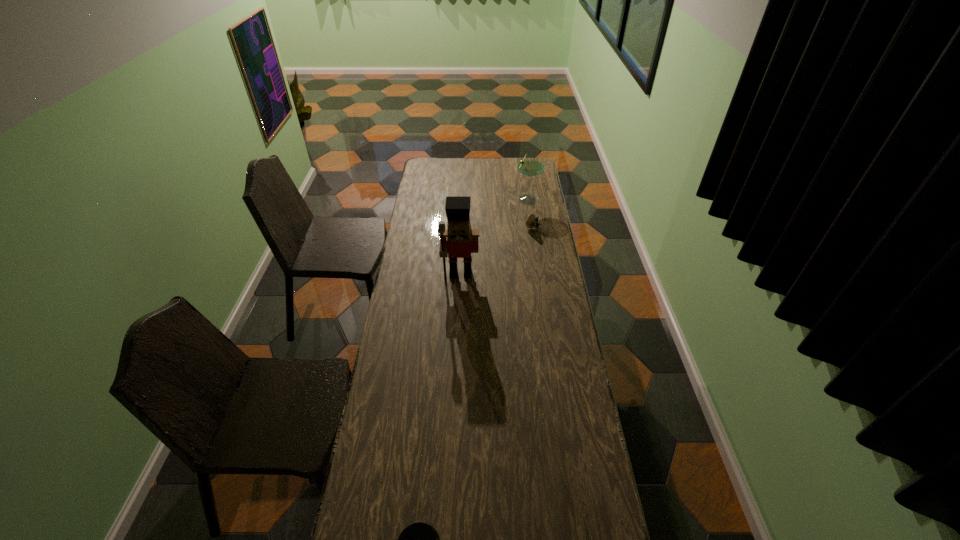
The height and width of the screenshot is (540, 960). In order to click on the tallest object in this screenshot , I will do `click(459, 240)`.

Image resolution: width=960 pixels, height=540 pixels. I want to click on nutcracker, so click(459, 240).

In order to click on martini in this screenshot , I will do 530,166.

Locate an element on the screen. the farthest object is located at coordinates (530, 166).

The image size is (960, 540). Find the location of `avocado`. avocado is located at coordinates (532, 222).

Locate an element on the screen. the third tallest object is located at coordinates (532, 222).

The height and width of the screenshot is (540, 960). I want to click on free space located 0.190m in front of the tallest object holding the staff, so click(x=459, y=315).

You are a GUI agent. You are given a task and a screenshot of the screen. Output one action in this format:
    pyautogui.click(x=<x>, y=<y>)
    Task: Click on the vacant space situated 0.300m on the left of the martini
    
    Given the screenshot: What is the action you would take?
    pyautogui.click(x=461, y=198)

This screenshot has height=540, width=960. I want to click on free space located on the seed side of the third tallest object, so click(539, 258).

The width and height of the screenshot is (960, 540). In order to click on martini at the right edge in this screenshot , I will do `click(530, 166)`.